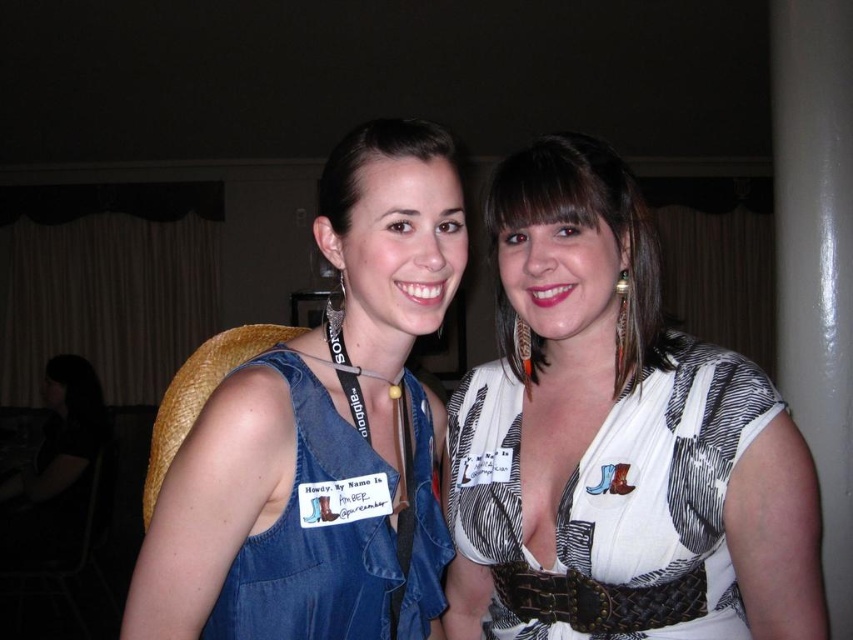
Between point (552, 326) and point (386, 605), which one is positioned in front?

Positioned in front is point (386, 605).

Who is lower down, white printed dress at center or denim vest at left?

denim vest at left is lower down.

Image resolution: width=853 pixels, height=640 pixels. In order to click on white printed dress at center in this screenshot , I will do click(x=616, y=440).

Is point (334, 240) positioned after point (346, 218)?

That is True.

Is denim dress at center positioned at the back of matte black hair at center?

That is False.

The height and width of the screenshot is (640, 853). I want to click on denim dress at center, so click(x=323, y=433).

Locate an element on the screen. The width and height of the screenshot is (853, 640). denim dress at center is located at coordinates (323, 433).

Is white textured blouse at center positioned at the back of matte black hair at center?

Yes, it is behind matte black hair at center.

Can you confirm if white textured blouse at center is wider than matte black hair at center?

Correct, the width of white textured blouse at center exceeds that of matte black hair at center.

The width and height of the screenshot is (853, 640). Describe the element at coordinates (589, 227) in the screenshot. I see `white textured blouse at center` at that location.

The image size is (853, 640). I want to click on white textured blouse at center, so click(589, 227).